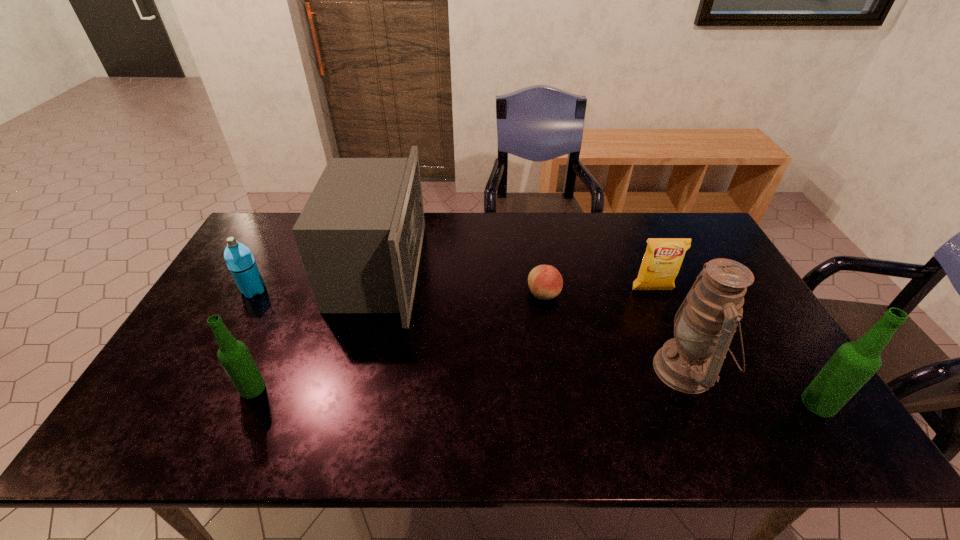
To make them evenly spaced by inserting another beer_bottle among them, please locate a free space for this new beer_bottle. Please provide its 2D coordinates. Your answer should be formatted as a tuple, i.e. [(x, y)], where the tuple contains the x and y coordinates of a point satisfying the conditions above.

[(532, 396)]